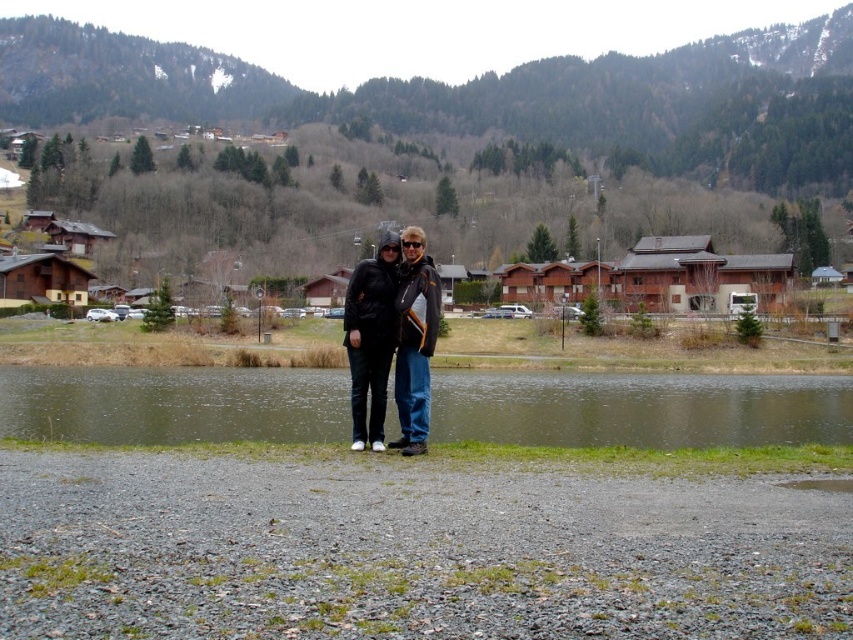
Question: Is greenish water at center behind matte black jackets at center?

Choices:
 (A) no
 (B) yes

Answer: (B)

Question: Is greenish water at center above matte black jackets at center?

Choices:
 (A) no
 (B) yes

Answer: (A)

Question: Can you confirm if greenish water at center is positioned above matte black jackets at center?

Choices:
 (A) no
 (B) yes

Answer: (A)

Question: Among these objects, which one is farthest from the camera?

Choices:
 (A) matte black jackets at center
 (B) greenish water at center

Answer: (B)